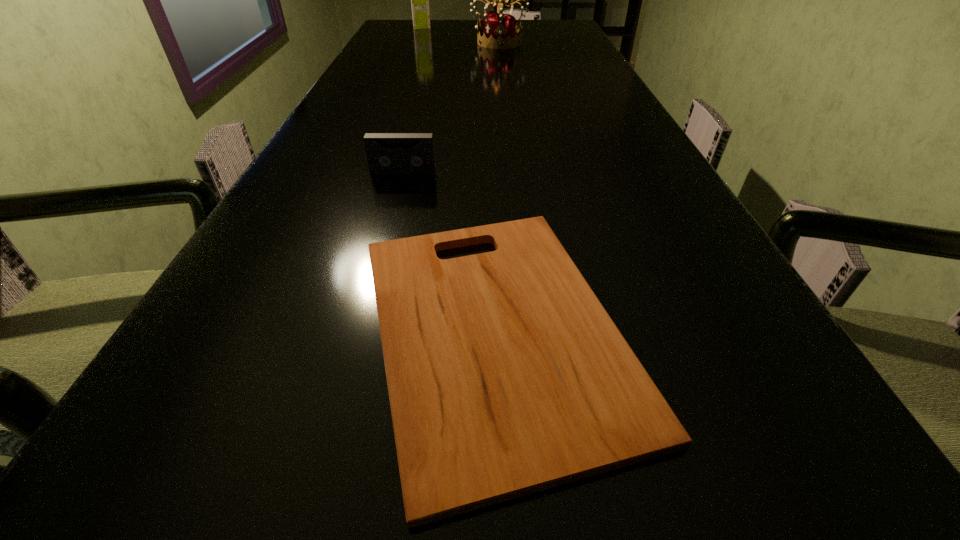
I want to click on object present at the far edge, so click(x=419, y=0).

Find the location of a particular element. This screenshot has width=960, height=540. object that is at the near edge is located at coordinates (506, 376).

The width and height of the screenshot is (960, 540). Identify the location of soya milk that is at the left edge. (419, 0).

Where is `videotape situated at the left edge`? This screenshot has height=540, width=960. videotape situated at the left edge is located at coordinates (387, 153).

Where is `object positioned at the right edge`? object positioned at the right edge is located at coordinates (506, 376).

Image resolution: width=960 pixels, height=540 pixels. In order to click on object situated at the far left corner in this screenshot , I will do `click(419, 0)`.

Where is `object that is at the near right corner`? The width and height of the screenshot is (960, 540). object that is at the near right corner is located at coordinates (506, 376).

Find the location of a particular element. This screenshot has width=960, height=540. free space at the left edge of the desktop is located at coordinates (342, 201).

Locate an element on the screen. The height and width of the screenshot is (540, 960). free space at the right edge of the desktop is located at coordinates (625, 155).

In the image, there is a desktop. In order to click on vacant space at the far left corner in this screenshot , I will do `click(391, 21)`.